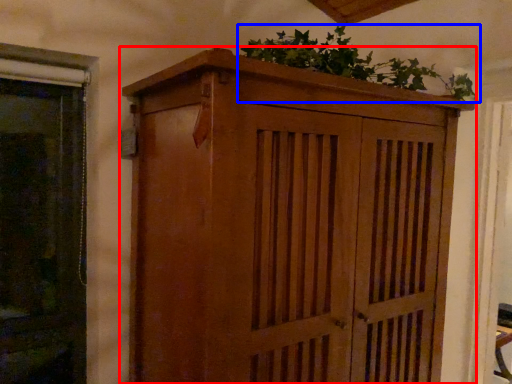
Question: Which point is further to the camera, cupboard (highlighted by a red box) or houseplant (highlighted by a blue box)?

Choices:
 (A) cupboard
 (B) houseplant

Answer: (B)